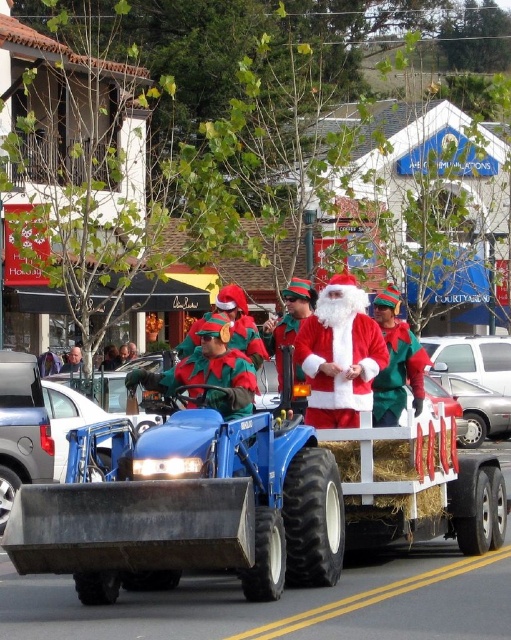
Between wooden hay at center and silver metallic sedan at center, which one has less height?

silver metallic sedan at center is shorter.

Does wooden hay at center have a greater width compared to silver metallic sedan at center?

Indeed, wooden hay at center has a greater width compared to silver metallic sedan at center.

What do you see at coordinates (248, 500) in the screenshot? The width and height of the screenshot is (511, 640). I see `wooden hay at center` at bounding box center [248, 500].

Identify the location of wooden hay at center. This screenshot has width=511, height=640. (248, 500).

Is silver metallic car at center above silver metallic sedan at center?

Yes, silver metallic car at center is above silver metallic sedan at center.

Does silver metallic car at center appear on the left side of silver metallic sedan at center?

No, silver metallic car at center is not to the left of silver metallic sedan at center.

At what (x,y) coordinates should I click in order to perform the action: click on silver metallic car at center. Please return your answer as a coordinate pair (x, y). Image resolution: width=511 pixels, height=640 pixels. Looking at the image, I should click on (473, 358).

Is wooden hay at center thinner than green felt hat at center?

In fact, wooden hay at center might be wider than green felt hat at center.

You are a GUI agent. You are given a task and a screenshot of the screen. Output one action in this format:
    pyautogui.click(x=<x>, y=<y>)
    Task: Click on the wooden hay at center
    The height and width of the screenshot is (640, 511).
    Given the screenshot: What is the action you would take?
    pyautogui.click(x=248, y=500)